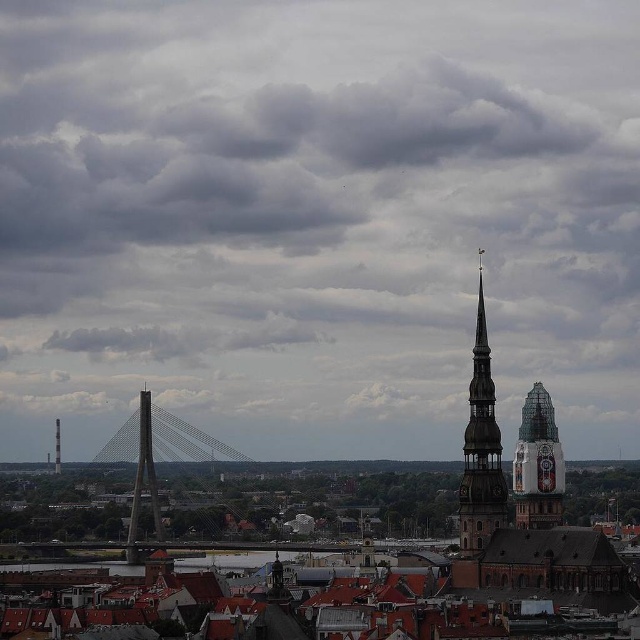
Question: Can you confirm if dark gray stone spire at center-right is thinner than shiny glass bell tower at right?

Choices:
 (A) no
 (B) yes

Answer: (B)

Question: Based on their relative distances, which object is farther from the metallic cable-stayed bridge at center-left?

Choices:
 (A) shiny glass bell tower at right
 (B) dark gray stone spire at center-right
 (C) cloudy sky at upper center

Answer: (B)

Question: Which of the following is the closest to the observer?

Choices:
 (A) cloudy sky at upper center
 (B) dark gray stone spire at center-right
 (C) metallic cable-stayed bridge at center-left
 (D) shiny glass bell tower at right

Answer: (B)

Question: Is dark gray stone spire at center-right above shiny glass bell tower at right?

Choices:
 (A) no
 (B) yes

Answer: (B)

Question: Where is cloudy sky at upper center located in relation to dark gray stone spire at center-right in the image?

Choices:
 (A) left
 (B) right

Answer: (A)

Question: Which of the following is the closest to the observer?

Choices:
 (A) shiny glass bell tower at right
 (B) cloudy sky at upper center
 (C) dark gray stone spire at center-right
 (D) metallic cable-stayed bridge at center-left

Answer: (C)